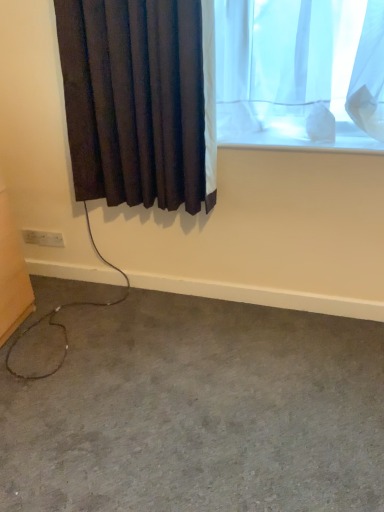
Identify the location of gray carpet at lower left. The width and height of the screenshot is (384, 512). (199, 412).

The height and width of the screenshot is (512, 384). I want to click on gray carpet at lower left, so click(199, 412).

Can you tell me how much white plastic electric outlet at lower left and gray carpet at lower left differ in facing direction?

A: 89.6 degrees separate the facing orientations of white plastic electric outlet at lower left and gray carpet at lower left.

Which point is more distant from viewer, (53, 237) or (30, 484)?

The point (53, 237) is more distant.

From the picture: Is gray carpet at lower left at the back of white plastic electric outlet at lower left?

No, white plastic electric outlet at lower left is not facing away from gray carpet at lower left.

From a real-world perspective, is white plastic electric outlet at lower left above or below gray carpet at lower left?

Clearly, from a real-world perspective, white plastic electric outlet at lower left is above gray carpet at lower left.

This screenshot has width=384, height=512. I want to click on curtain located above the white plastic electric outlet at lower left (from the image's perspective), so pos(140,100).

What's the angular difference between white plastic electric outlet at lower left and dark fabric curtain at left's facing directions?

0.817 degrees.

Considering the relative positions of white plastic electric outlet at lower left and dark fabric curtain at left in the image provided, is white plastic electric outlet at lower left to the right of dark fabric curtain at left from the viewer's perspective?

Incorrect, white plastic electric outlet at lower left is not on the right side of dark fabric curtain at left.

Measure the distance from white plastic electric outlet at lower left to dark fabric curtain at left.

white plastic electric outlet at lower left is 34.07 inches away from dark fabric curtain at left.

Does gray carpet at lower left have a smaller size compared to dark fabric curtain at left?

Incorrect, gray carpet at lower left is not smaller in size than dark fabric curtain at left.

Which object is more forward, gray carpet at lower left or dark fabric curtain at left?

gray carpet at lower left is closer to the camera.

Can you tell me how much gray carpet at lower left and dark fabric curtain at left differ in facing direction?

The angle between the facing direction of gray carpet at lower left and the facing direction of dark fabric curtain at left is 88.8 degrees.

Can we say gray carpet at lower left lies outside dark fabric curtain at left?

Yes.

Is point (86, 185) closer to viewer compared to point (37, 311)?

Yes.

From their relative heights in the image, would you say dark fabric curtain at left is taller or shorter than gray carpet at lower left?

Considering their sizes, dark fabric curtain at left has more height than gray carpet at lower left.

Which object is further away from the camera taking this photo, dark fabric curtain at left or gray carpet at lower left?

dark fabric curtain at left is further away from the camera.

Measure the distance between dark fabric curtain at left and gray carpet at lower left.

36.10 inches.

In terms of size, does dark fabric curtain at left appear bigger or smaller than white plastic electric outlet at lower left?

In the image, dark fabric curtain at left appears to be larger than white plastic electric outlet at lower left.

Does dark fabric curtain at left appear on the right side of white plastic electric outlet at lower left?

Correct, you'll find dark fabric curtain at left to the right of white plastic electric outlet at lower left.

Is dark fabric curtain at left far away from white plastic electric outlet at lower left?

No, there isn't a large distance between dark fabric curtain at left and white plastic electric outlet at lower left.

I want to click on electric outlet that is on the left side of dark fabric curtain at left, so click(43, 238).

Is gray carpet at lower left looking in the opposite direction of white plastic electric outlet at lower left?

gray carpet at lower left is not turned away from white plastic electric outlet at lower left.

Identify the location of electric outlet lying on the left of gray carpet at lower left. The width and height of the screenshot is (384, 512). (43, 238).

Can you confirm if gray carpet at lower left is thinner than white plastic electric outlet at lower left?

No, gray carpet at lower left is not thinner than white plastic electric outlet at lower left.

From the picture: Considering the positions of objects gray carpet at lower left and white plastic electric outlet at lower left in the image provided, who is more to the left, gray carpet at lower left or white plastic electric outlet at lower left?

From the viewer's perspective, white plastic electric outlet at lower left appears more on the left side.

Identify the location of electric outlet that appears on the left of gray carpet at lower left. The height and width of the screenshot is (512, 384). (43, 238).

This screenshot has width=384, height=512. In order to click on electric outlet directly beneath the dark fabric curtain at left (from a real-world perspective) in this screenshot , I will do `click(43, 238)`.

Considering their positions, is white plastic electric outlet at lower left positioned further to dark fabric curtain at left than gray carpet at lower left?

The object further to dark fabric curtain at left is gray carpet at lower left.

When comparing their distances from white plastic electric outlet at lower left, does dark fabric curtain at left or gray carpet at lower left seem closer?

dark fabric curtain at left lies closer to white plastic electric outlet at lower left than the other object.

Looking at the image, which one is located closer to dark fabric curtain at left, gray carpet at lower left or white plastic electric outlet at lower left?

Based on the image, white plastic electric outlet at lower left appears to be nearer to dark fabric curtain at left.

Based on their spatial positions, is gray carpet at lower left or dark fabric curtain at left closer to white plastic electric outlet at lower left?

dark fabric curtain at left is positioned closer to the anchor white plastic electric outlet at lower left.

Based on their spatial positions, is dark fabric curtain at left or white plastic electric outlet at lower left closer to gray carpet at lower left?

dark fabric curtain at left is positioned closer to the anchor gray carpet at lower left.

Based on the photo, estimate the real-world distances between objects in this image. Which object is further from gray carpet at lower left, white plastic electric outlet at lower left or dark fabric curtain at left?

white plastic electric outlet at lower left is positioned further to the anchor gray carpet at lower left.

The image size is (384, 512). I want to click on curtain positioned between gray carpet at lower left and white plastic electric outlet at lower left from near to far, so click(140, 100).